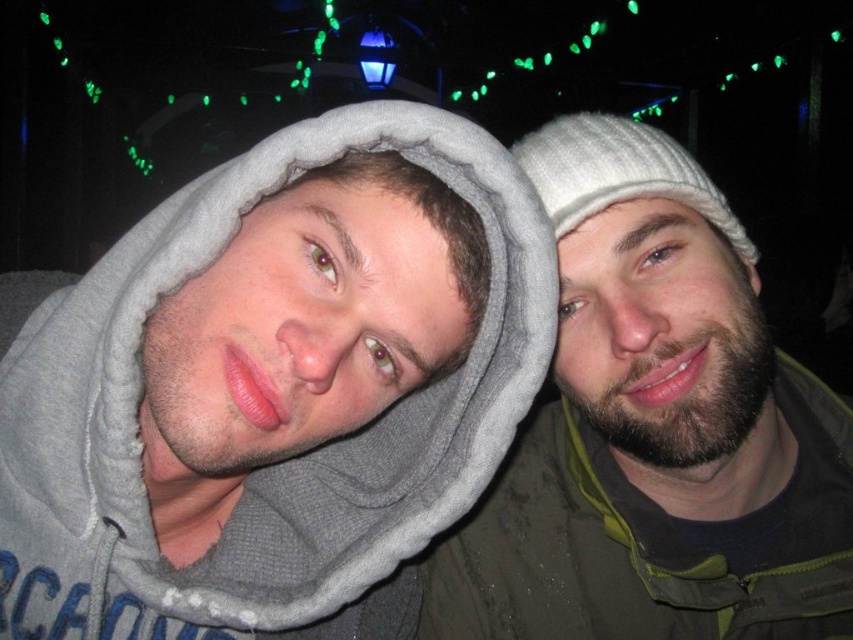
You are standing in a dimly lit indoor space with string lights above you. You see a bearded man at right and a white knitted hat at upper right. Which object is positioned more to the right?

The bearded man at right is positioned more to the right than the white knitted hat at upper right.